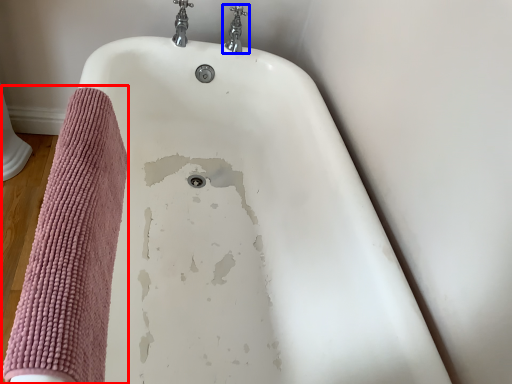
Question: Which object appears farthest to the camera in this image, bath towel (highlighted by a red box) or tap (highlighted by a blue box)?

Choices:
 (A) bath towel
 (B) tap

Answer: (B)